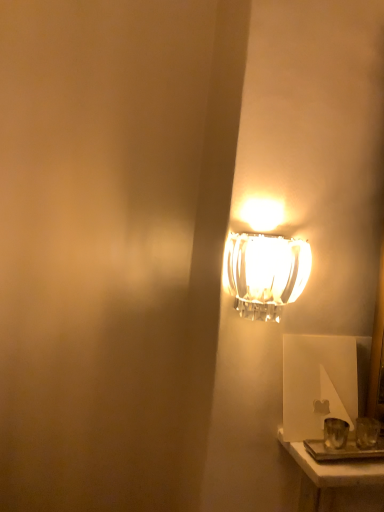
At what (x,y) coordinates should I click in order to perform the action: click on clear glass lamp at upper right. Please return your answer as a coordinate pair (x, y). This screenshot has height=512, width=384. Looking at the image, I should click on (265, 273).

What do you see at coordinates (265, 273) in the screenshot? The image size is (384, 512). I see `clear glass lamp at upper right` at bounding box center [265, 273].

The width and height of the screenshot is (384, 512). Identify the location of clear glass lamp at upper right. 265,273.